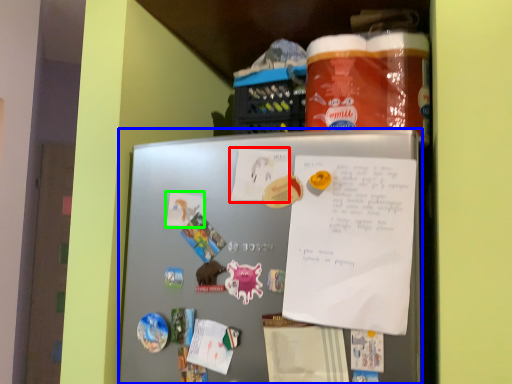
Question: Based on their relative distances, which object is nearer to paper (highlighted by a red box)? Choose from refrigerator (highlighted by a blue box) and paper (highlighted by a green box).

Choices:
 (A) refrigerator
 (B) paper

Answer: (B)